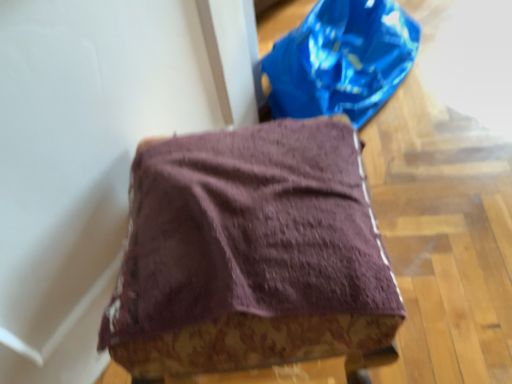
Locate an element on the screen. vacant area that is situated to the right of purple fabric-covered stool at center is located at coordinates (435, 259).